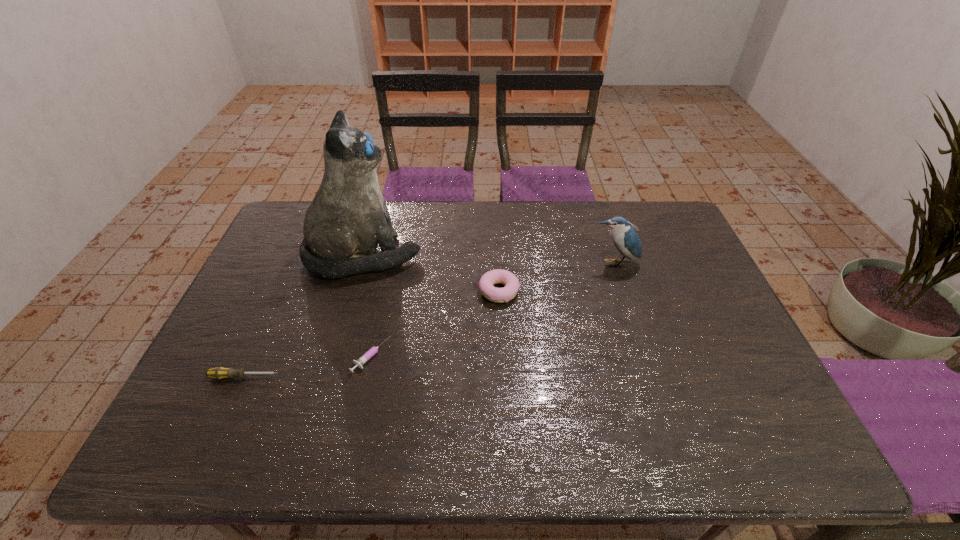
The image size is (960, 540). Identify the location of free spot between the second object from right to left and the syringe. (435, 323).

Image resolution: width=960 pixels, height=540 pixels. I want to click on object that stands as the second closest to the fourth object from left to right, so click(x=625, y=238).

Identify which object is the closest to the cat. Please provide its 2D coordinates. Your answer should be formatted as a tuple, i.e. [(x, y)], where the tuple contains the x and y coordinates of a point satisfying the conditions above.

[(498, 276)]

Where is `vacant space that satisfies the following two spatial constraints: 1. at the face of the cat; 2. on the left side of the syringe`? vacant space that satisfies the following two spatial constraints: 1. at the face of the cat; 2. on the left side of the syringe is located at coordinates (335, 356).

I want to click on free spot that satisfies the following two spatial constraints: 1. on the back side of the third shortest object; 2. on the right side of the syringe, so click(x=385, y=292).

The width and height of the screenshot is (960, 540). I want to click on vacant point that satisfies the following two spatial constraints: 1. on the back side of the syringe; 2. at the face of the tallest object, so click(x=393, y=255).

Find the location of a particular element. This screenshot has height=540, width=960. free space that satisfies the following two spatial constraints: 1. on the front side of the shortest object; 2. at the tip of the screwdriver is located at coordinates (367, 377).

At what (x,y) coordinates should I click in order to perform the action: click on vacant space that satisfies the following two spatial constraints: 1. at the tip of the second tallest object's beak; 2. at the tip of the screwdriver. Please return your answer as a coordinate pair (x, y). This screenshot has width=960, height=540. Looking at the image, I should click on (651, 377).

Find the location of `free location that satisfies the following two spatial constraints: 1. on the front side of the fourth object from left to right; 2. at the tip of the screwdriver`. free location that satisfies the following two spatial constraints: 1. on the front side of the fourth object from left to right; 2. at the tip of the screwdriver is located at coordinates (502, 377).